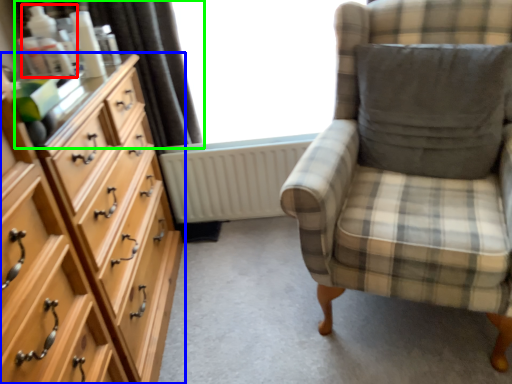
Question: Considering the real-world distances, which object is closest to toiletry (highlighted by a red box)? chest of drawers (highlighted by a blue box) or curtain (highlighted by a green box).

Choices:
 (A) chest of drawers
 (B) curtain

Answer: (B)